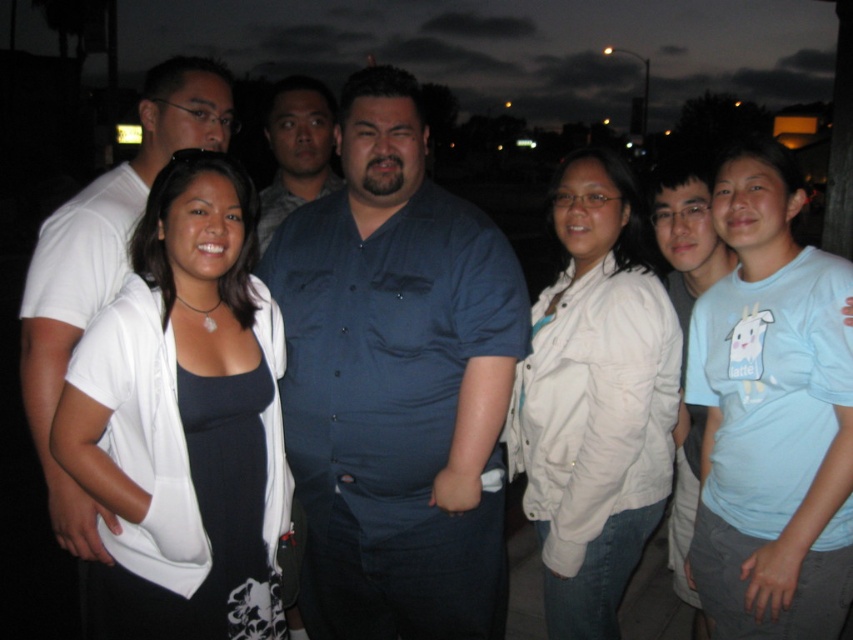
Between white matte shirt at center and white matte jacket at center, which one appears on the right side from the viewer's perspective?

white matte jacket at center is more to the right.

Describe the element at coordinates (184, 417) in the screenshot. The width and height of the screenshot is (853, 640). I see `white matte shirt at center` at that location.

This screenshot has height=640, width=853. What are the coordinates of `white matte shirt at center` in the screenshot? It's located at (184, 417).

Looking at this image, measure the distance between white matte shirt at center and matte blue shirt at center.

white matte shirt at center is 26.01 inches from matte blue shirt at center.

In the scene shown: Does white matte shirt at center have a larger size compared to matte blue shirt at center?

No.

Which is in front, point (136, 404) or point (283, 116)?

Point (136, 404) is in front.

I want to click on white matte shirt at center, so click(x=184, y=417).

Can you confirm if dark blue button-up shirt at center is smaller than white matte shirt at center?

No.

Does dark blue button-up shirt at center appear under white matte shirt at center?

Incorrect, dark blue button-up shirt at center is not positioned below white matte shirt at center.

Between point (448, 211) and point (244, 630), which one is positioned behind?

The point (448, 211) is more distant.

Find the location of a particular element. The width and height of the screenshot is (853, 640). dark blue button-up shirt at center is located at coordinates (396, 384).